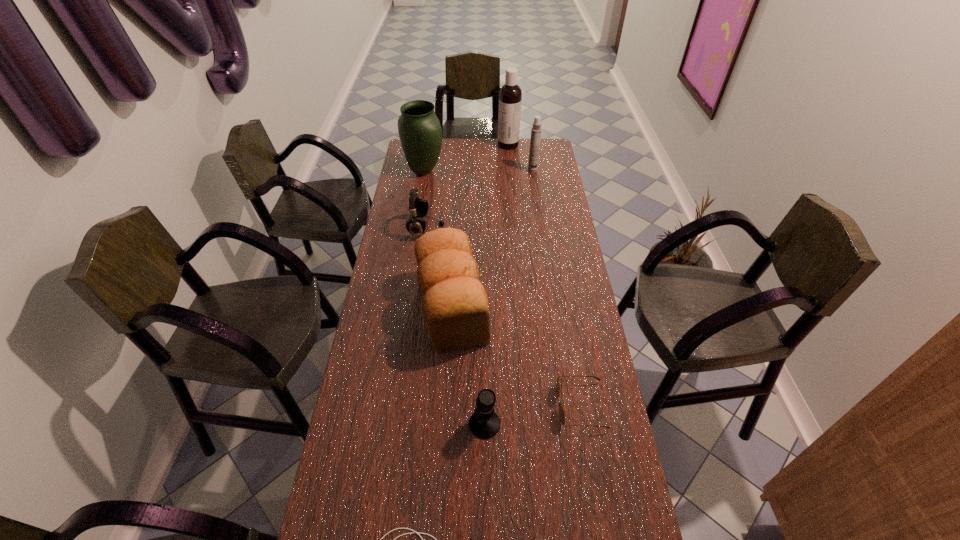
Locate an element on the screen. empty space between the aerosol can and the headset is located at coordinates (480, 199).

This screenshot has height=540, width=960. In order to click on free area in between the vase and the fourth farthest object in this screenshot , I will do `click(425, 199)`.

Find the location of a particular element. The width and height of the screenshot is (960, 540). unoccupied position between the bread and the microphone is located at coordinates (468, 366).

Where is `the seventh closest object to the microphone`? This screenshot has height=540, width=960. the seventh closest object to the microphone is located at coordinates (510, 95).

This screenshot has width=960, height=540. What are the coordinates of `the fifth closest object to the headset` in the screenshot? It's located at (561, 410).

Where is `free space that satisfies the following two spatial constraints: 1. with the microphone on the side of the microphone; 2. on the right side of the fifth nearest object`? The image size is (960, 540). free space that satisfies the following two spatial constraints: 1. with the microphone on the side of the microphone; 2. on the right side of the fifth nearest object is located at coordinates (400, 424).